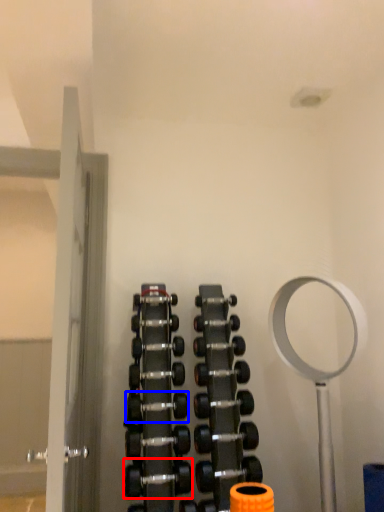
Question: Which point is further to the camera, dumbbell (highlighted by a red box) or dumbbell (highlighted by a blue box)?

Choices:
 (A) dumbbell
 (B) dumbbell

Answer: (B)